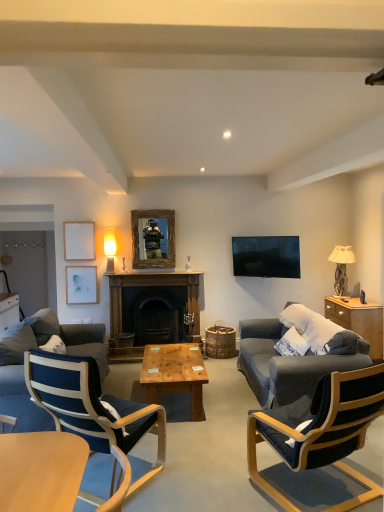
Identify the location of vacant space to the left of dark blue fabric chair at right, the 2th chair positioned from the left. [214, 472].